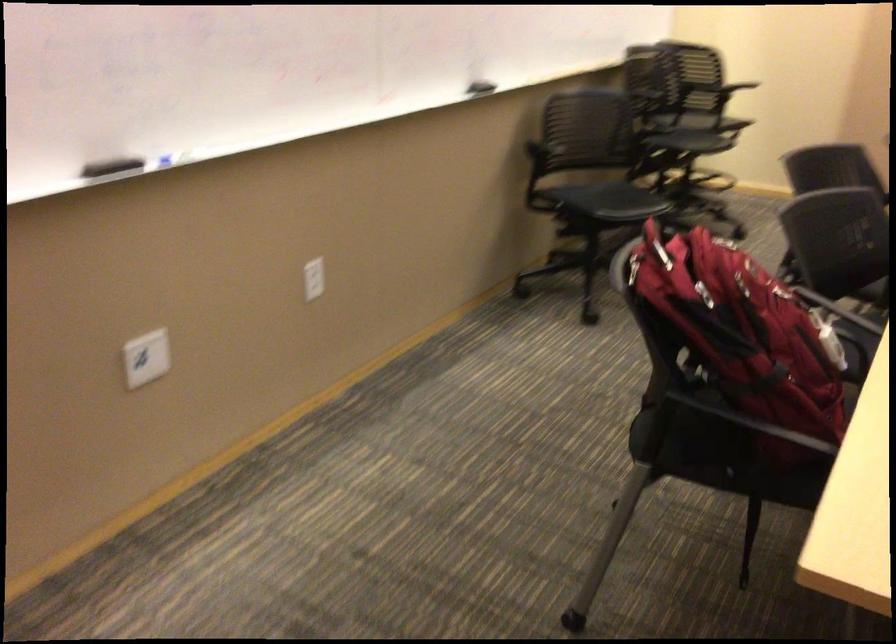
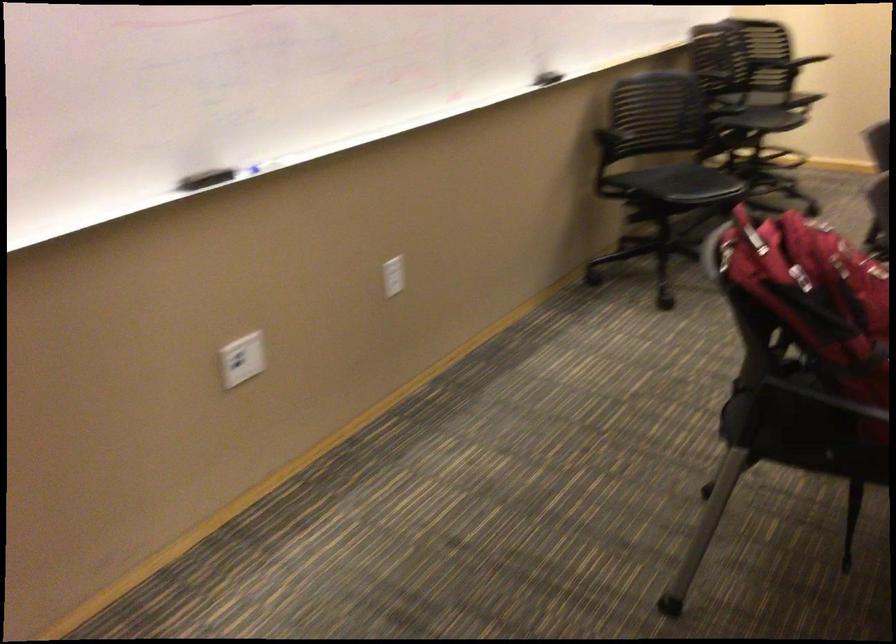
Find the pixel in the second image that matches (148,357) in the first image.

(242, 359)